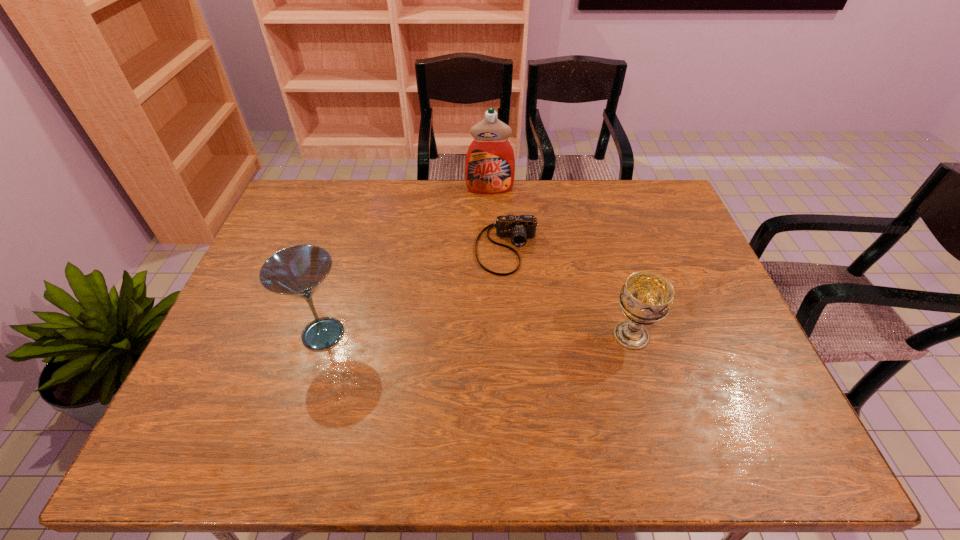
This screenshot has width=960, height=540. In the image, there is a desktop. Find the location of `vacant space at the far left corner`. vacant space at the far left corner is located at coordinates pyautogui.click(x=337, y=184).

The image size is (960, 540). I want to click on vacant space that is in between the rightmost object and the detergent, so 561,262.

At what (x,y) coordinates should I click in order to perform the action: click on free spot between the chalice and the detergent. Please return your answer as a coordinate pair (x, y). The image size is (960, 540). Looking at the image, I should click on (561, 262).

Identify the location of unoccupied area between the third nearest object and the third shortest object. This screenshot has height=540, width=960. (416, 291).

This screenshot has width=960, height=540. I want to click on free point between the chalice and the shortest object, so click(x=569, y=292).

You are a GUI agent. You are given a task and a screenshot of the screen. Output one action in this format:
    pyautogui.click(x=<x>, y=<y>)
    Task: Click on the empty space between the tallest object and the rightmost object
    The width and height of the screenshot is (960, 540).
    Given the screenshot: What is the action you would take?
    pyautogui.click(x=561, y=262)

Locate an element on the screen. This screenshot has height=540, width=960. free space between the second tallest object and the rightmost object is located at coordinates (477, 335).

Image resolution: width=960 pixels, height=540 pixels. What are the coordinates of `empty space that is in between the rightmost object and the detergent` in the screenshot? It's located at (561, 262).

You are a GUI agent. You are given a task and a screenshot of the screen. Output one action in this format:
    pyautogui.click(x=<x>, y=<y>)
    Task: Click on the free space between the chalice and the detergent
    The width and height of the screenshot is (960, 540).
    Given the screenshot: What is the action you would take?
    pyautogui.click(x=561, y=262)

The image size is (960, 540). Find the location of `vacant area that lies between the leftmost object and the detergent`. vacant area that lies between the leftmost object and the detergent is located at coordinates (406, 261).